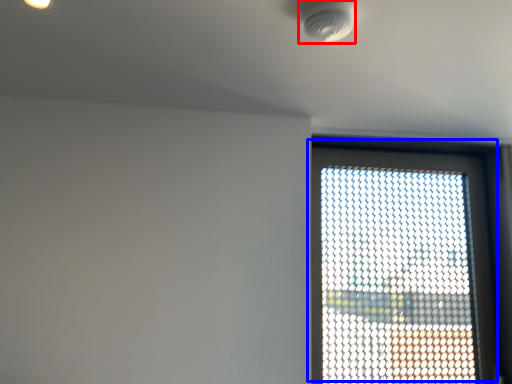
Question: Which of the following is the closest to the observer, light fixture (highlighted by a red box) or window (highlighted by a blue box)?

Choices:
 (A) light fixture
 (B) window

Answer: (A)